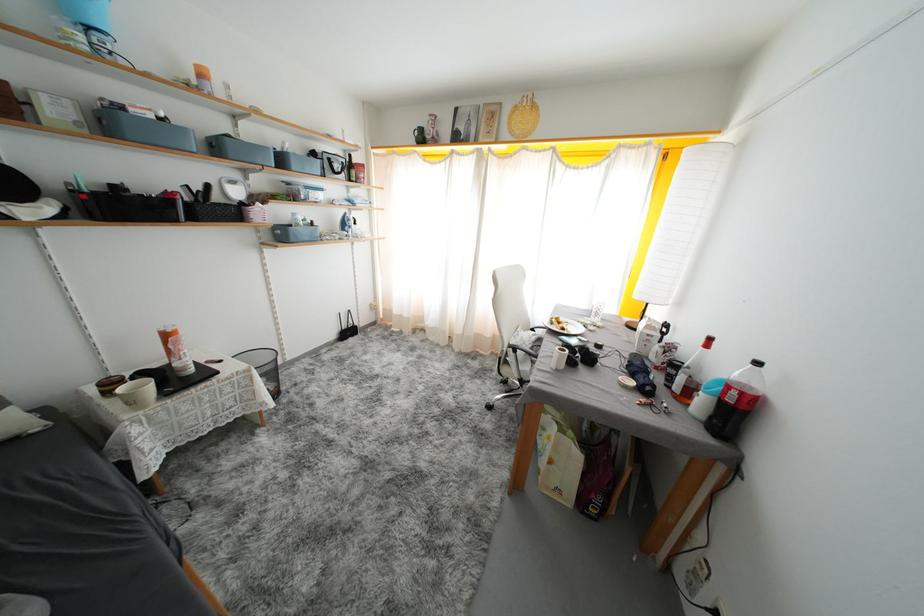
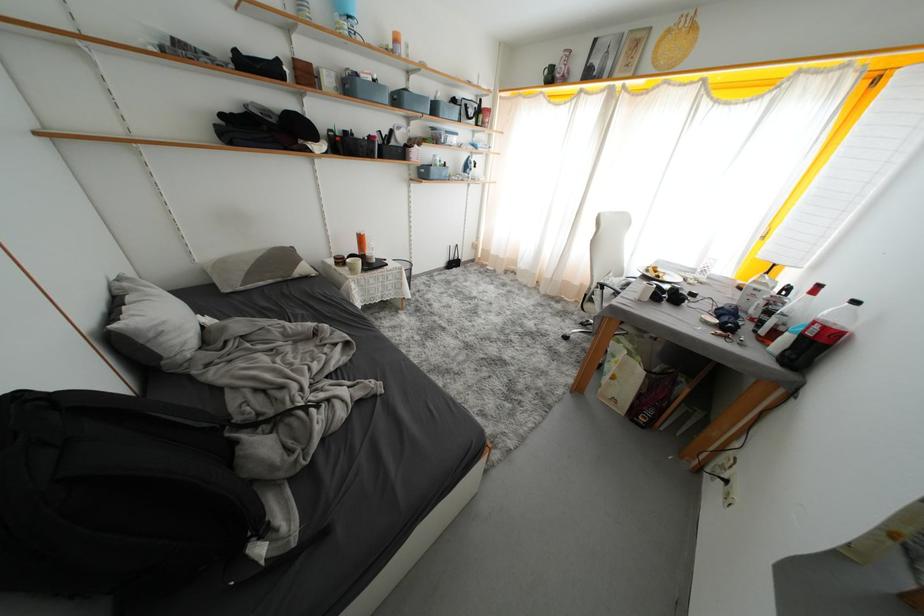
In the second image, find the point that corresponds to pixel 214 190 in the first image.

(397, 136)